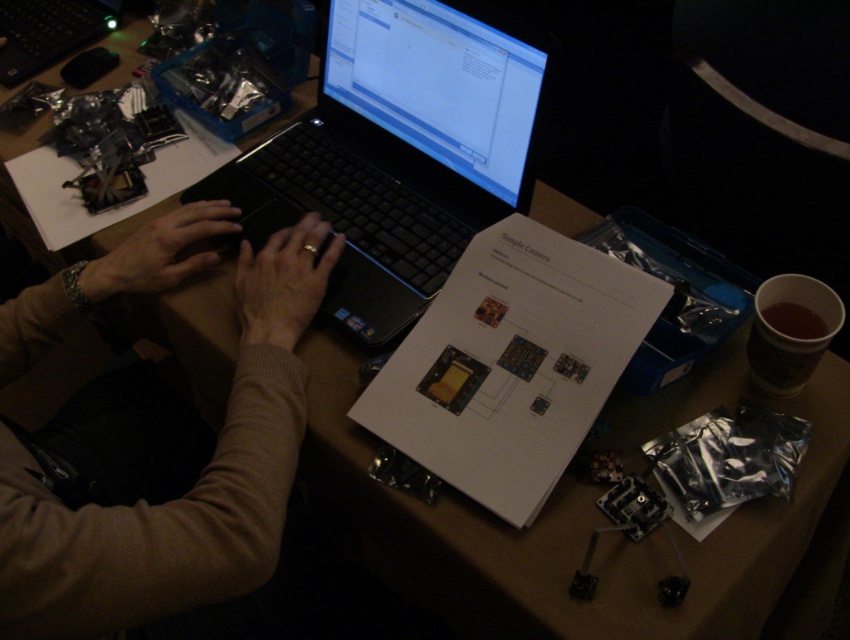
Question: Based on their relative distances, which object is farther from the black matte laptop at center?

Choices:
 (A) matte black hand at center
 (B) black plastic laptop at upper center
 (C) matte black hands at center

Answer: (B)

Question: Which object appears closest to the camera in this image?

Choices:
 (A) matte black hand at center
 (B) matte black hands at center
 (C) black matte laptop at center
 (D) brown sweater at center

Answer: (D)

Question: Considering the relative positions of black matte laptop at center and black plastic laptop at upper center in the image provided, where is black matte laptop at center located with respect to black plastic laptop at upper center?

Choices:
 (A) below
 (B) above

Answer: (A)

Question: Observing the image, what is the correct spatial positioning of black matte laptop at center in reference to matte black hand at center?

Choices:
 (A) left
 (B) right

Answer: (B)

Question: Which point is farther to the camera?

Choices:
 (A) (64, 17)
 (B) (92, 285)

Answer: (A)

Question: Is black matte laptop at center closer to the viewer compared to matte black hands at center?

Choices:
 (A) yes
 (B) no

Answer: (B)